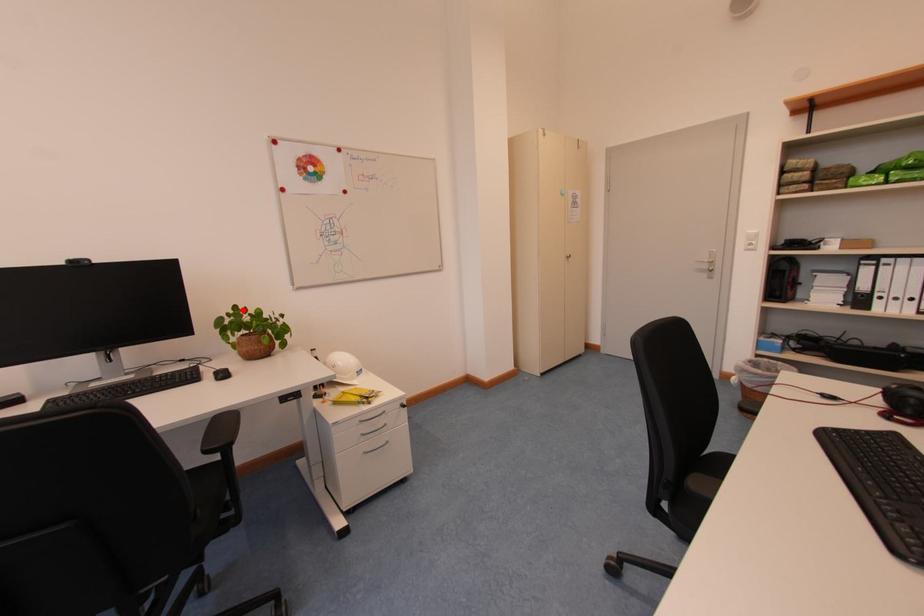
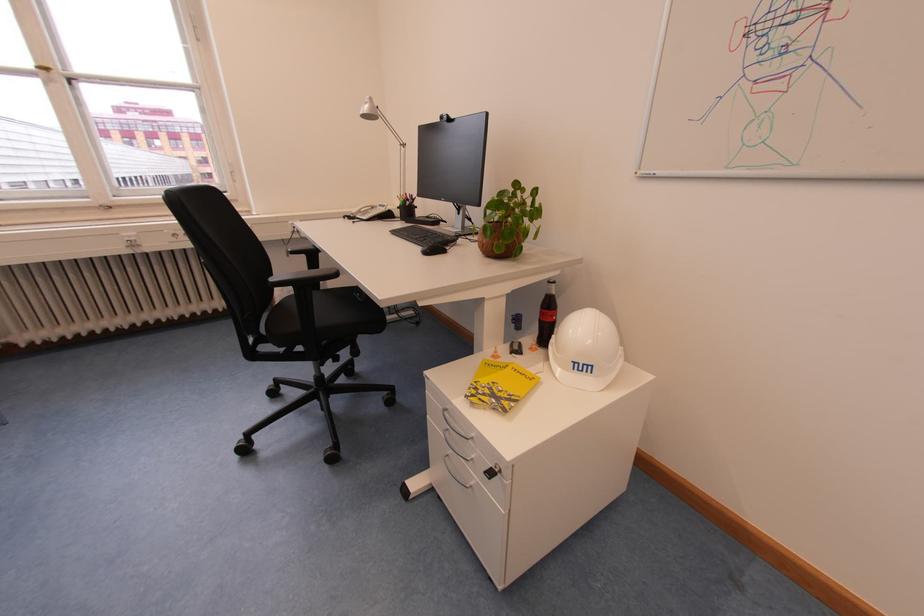
Where in the second image is the point corresponding to the highlighted location from the first image?

(524, 187)